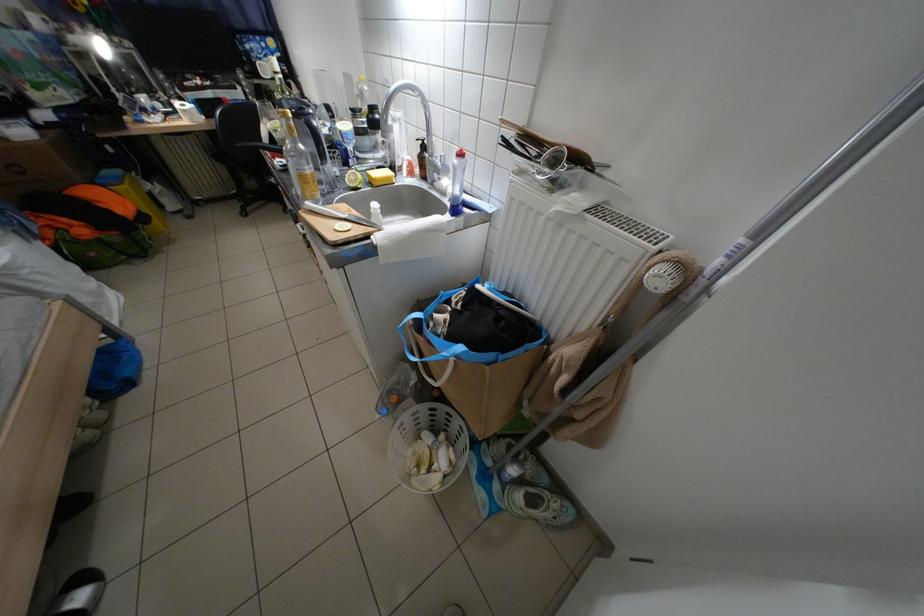
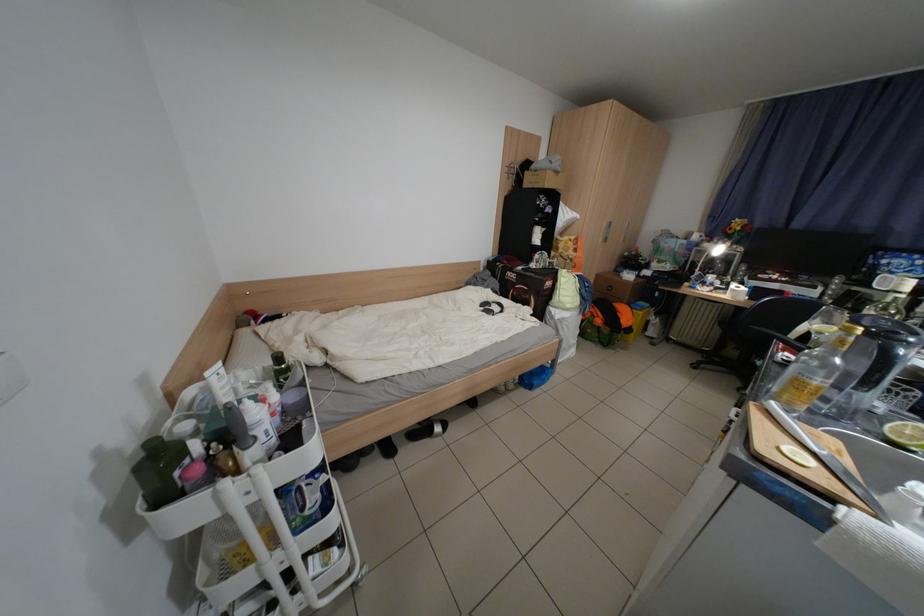
Locate, in the second image, the point that corresponds to point 354,179 in the first image.

(896, 421)